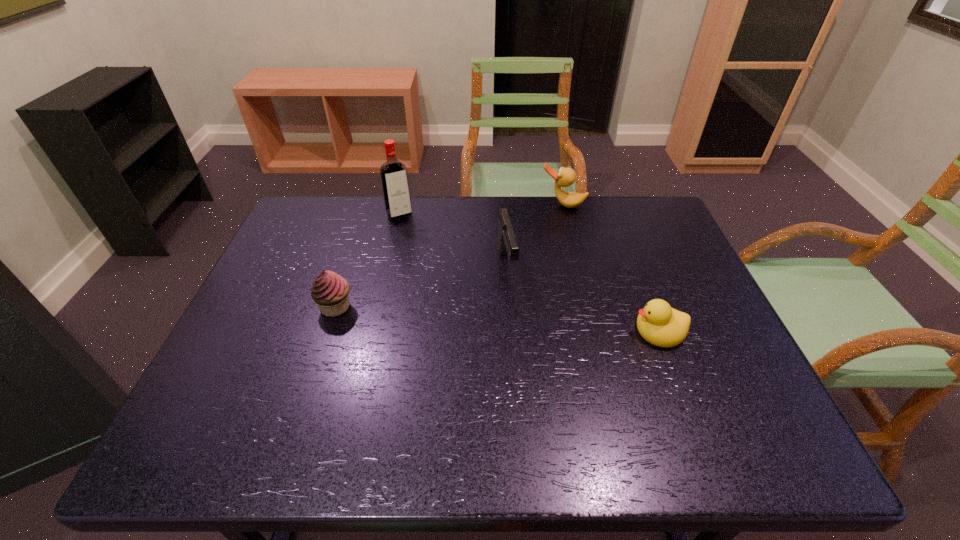
This screenshot has width=960, height=540. In order to click on vacant space in between the second object from left to right and the rightmost object in this screenshot , I will do `click(529, 273)`.

The height and width of the screenshot is (540, 960). Identify the location of vacant space that's between the third object from left to right and the duck. (535, 234).

This screenshot has width=960, height=540. Identify the location of free area in between the third nearest object and the cupcake. (421, 285).

I want to click on free space that is in between the duck and the third object from right to left, so click(535, 234).

Find the location of a particular element. Image resolution: width=960 pixels, height=540 pixels. vacant point located between the shortest object and the fourth object from right to left is located at coordinates (529, 273).

You are a GUI agent. You are given a task and a screenshot of the screen. Output one action in this format:
    pyautogui.click(x=<x>, y=<y>)
    Task: Click on the vacant space in between the fourth object from left to right and the third farthest object
    The image size is (960, 540).
    Given the screenshot: What is the action you would take?
    pyautogui.click(x=535, y=234)

Locate an element on the screen. This screenshot has height=540, width=960. free spot between the duckling and the leftmost object is located at coordinates (497, 319).

This screenshot has height=540, width=960. I want to click on free space between the shortest object and the tallest object, so click(529, 273).

Find the location of a particular element. The width and height of the screenshot is (960, 540). free space between the second object from left to right and the duck is located at coordinates (481, 210).

Identify which object is located as the third nearest to the tallest object. Please provide its 2D coordinates. Your answer should be formatted as a tuple, i.e. [(x, y)], where the tuple contains the x and y coordinates of a point satisfying the conditions above.

[(565, 177)]